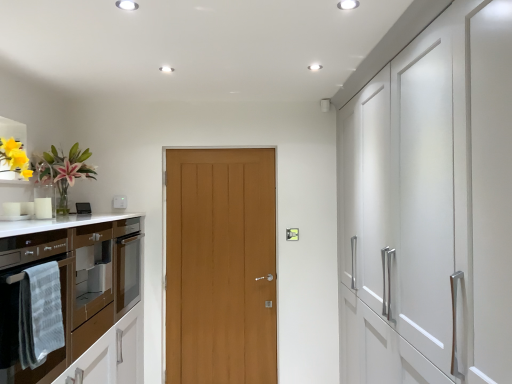
Question: Does point [x=39, y=301] appear closer or farther from the camera than point [x=211, y=241]?

Choices:
 (A) farther
 (B) closer

Answer: (B)

Question: Would you say gray textured towel at left is inside or outside light brown wood door at center, which is counted as the first door, starting from the back?

Choices:
 (A) inside
 (B) outside

Answer: (B)

Question: Considering the real-world distances, which object is farthest from the wooden door at center, the 1th door when ordered from front to back?

Choices:
 (A) gray textured towel at left
 (B) brown glossy oven at left
 (C) light brown wood door at center, which is counted as the first door, starting from the back
 (D) white plastic switch at upper center

Answer: (A)

Question: Estimate the real-world distances between objects in this image. Which object is closer to the brown glossy oven at left?

Choices:
 (A) white plastic switch at upper center
 (B) wooden door at center, the 2th door in the back-to-front sequence
 (C) gray textured towel at left
 (D) light brown wood door at center, acting as the second door starting from the front

Answer: (C)